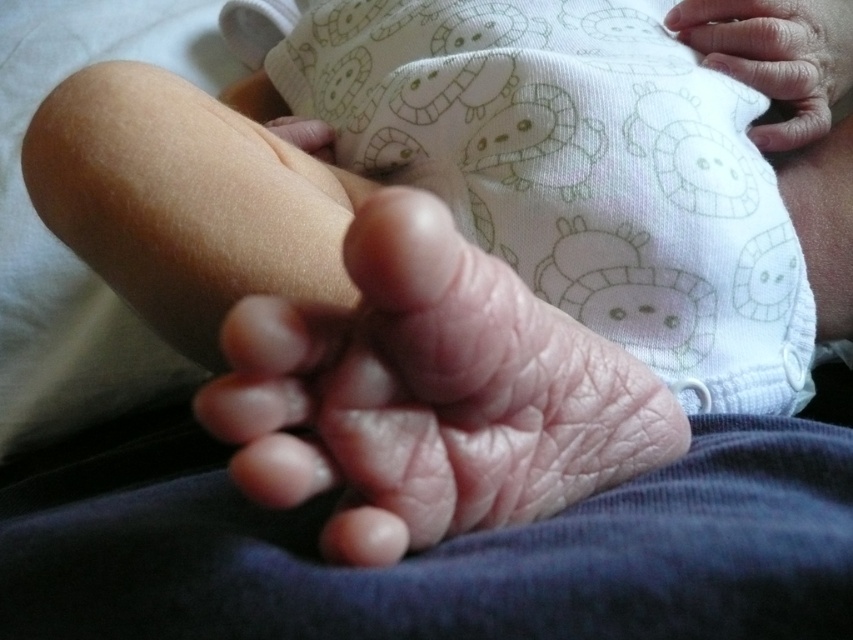
You are a physical therapist working with a baby. You need to gently hold the baby to perform a foot massage. The baby is lying on a changing table, and you see the pink skin hand at center and the smooth skin hand at upper right. Which hand should you use to stabilize the baby while massaging the foot?

You should use the smooth skin hand at upper right to stabilize the baby because it is farther away from the pink skin hand at center, providing better leverage and control during the massage.

You are a healthcare professional observing a baby and an adult. You need to determine which hand, the pink skin hand at center or the smooth skin hand at upper right, is more likely to belong to the baby based on their typical sizes. Which hand is wider?

The pink skin hand at center might be wider than smooth skin hand at upper right, so the pink skin hand at center is more likely to belong to the baby.

You are a photographer taking a closeup shot of a baby. You notice two hands in the frame. One is the pink skin hand at center and the other is the smooth skin hand at upper right. Which hand is positioned to the left in the image?

The pink skin hand at center is positioned to the left of the smooth skin hand at upper right.